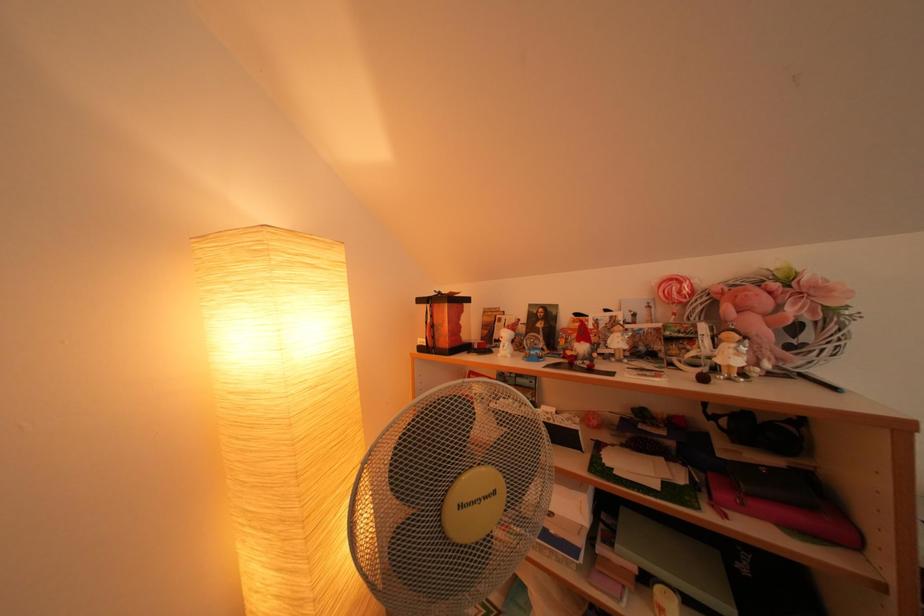
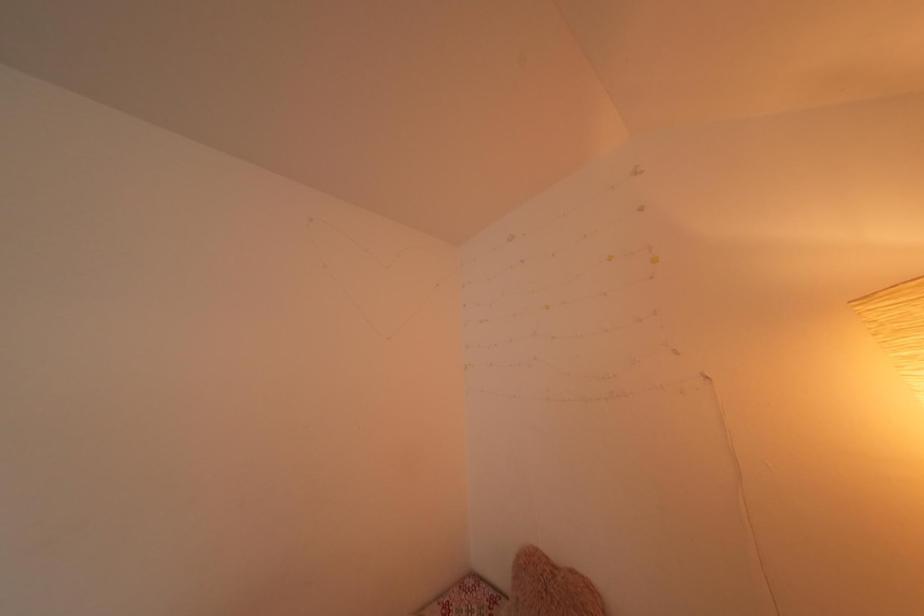
The first image is from the beginning of the video and the second image is from the end. How did the camera likely rotate when shooting the video?

The rotation direction of the camera is left-up.